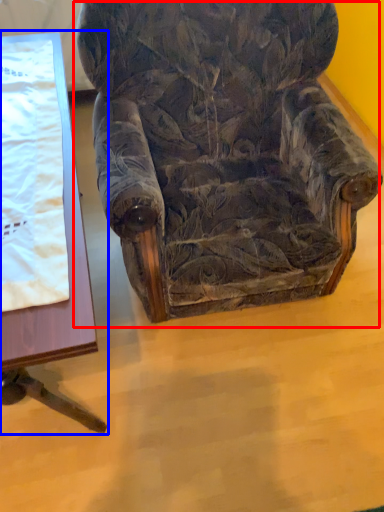
Question: Which point is further to the camera, chair (highlighted by a red box) or table (highlighted by a blue box)?

Choices:
 (A) chair
 (B) table

Answer: (B)